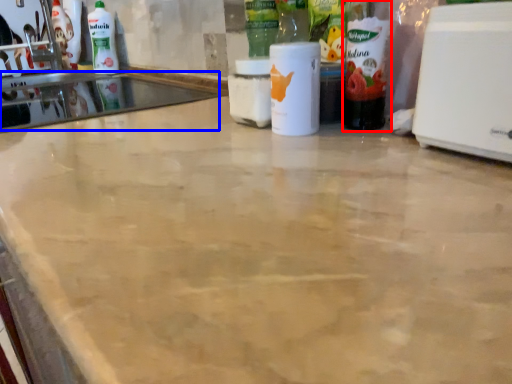
Question: Which point is closer to the camera, bottle (highlighted by a red box) or sink (highlighted by a blue box)?

Choices:
 (A) bottle
 (B) sink

Answer: (A)